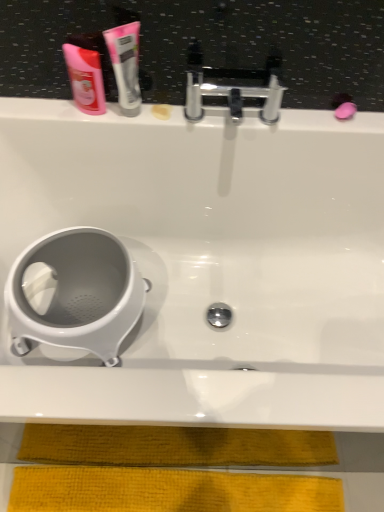
What do you see at coordinates (85, 72) in the screenshot? The width and height of the screenshot is (384, 512). I see `pink glossy mouthwash at upper left` at bounding box center [85, 72].

Measure the distance between white glossy tube at upper center and camera.

white glossy tube at upper center and camera are 33.54 inches apart from each other.

Where is `white plastic toilet at lower left`? Image resolution: width=384 pixels, height=512 pixels. white plastic toilet at lower left is located at coordinates (74, 294).

Is white glossy tube at upper center positioned beyond the bounds of white glossy bathtub at center?

Yes, white glossy tube at upper center is located beyond the bounds of white glossy bathtub at center.

Is white glossy tube at upper center wider or thinner than white glossy bathtub at center?

Clearly, white glossy tube at upper center has less width compared to white glossy bathtub at center.

Based on the photo, is white glossy tube at upper center smaller than white glossy bathtub at center?

Yes, white glossy tube at upper center is smaller than white glossy bathtub at center.

Which object is positioned more to the right, white glossy tube at upper center or white glossy bathtub at center?

white glossy bathtub at center is more to the right.

Is white plastic toilet at lower left further to camera compared to pink glossy mouthwash at upper left?

Yes, white plastic toilet at lower left is further from the viewer.

From a real-world perspective, between white plastic toilet at lower left and pink glossy mouthwash at upper left, who is vertically lower?

white plastic toilet at lower left is physically lower.

You are a GUI agent. You are given a task and a screenshot of the screen. Output one action in this format:
    pyautogui.click(x=<x>, y=<y>)
    Task: Click on the toilet to the left of pink glossy mouthwash at upper left
    The height and width of the screenshot is (512, 384).
    Given the screenshot: What is the action you would take?
    pyautogui.click(x=74, y=294)

Is white plastic toilet at lower left far from pink glossy mouthwash at upper left?

white plastic toilet at lower left is actually quite close to pink glossy mouthwash at upper left.

Image resolution: width=384 pixels, height=512 pixels. I want to click on bathtub located on the right of pink glossy mouthwash at upper left, so click(x=211, y=262).

Who is smaller, pink glossy mouthwash at upper left or white glossy bathtub at center?

With smaller size is pink glossy mouthwash at upper left.

Measure the distance from pink glossy mouthwash at upper left to white glossy bathtub at center.

pink glossy mouthwash at upper left and white glossy bathtub at center are 16.73 inches apart from each other.

From a real-world perspective, is pink glossy mouthwash at upper left above or below white glossy bathtub at center?

pink glossy mouthwash at upper left is above white glossy bathtub at center.

From the picture: Is white glossy tube at upper center at the back of white plastic toilet at lower left?

white plastic toilet at lower left does not have its back to white glossy tube at upper center.

Considering the relative positions of white plastic toilet at lower left and white glossy tube at upper center in the image provided, is white plastic toilet at lower left to the right of white glossy tube at upper center from the viewer's perspective?

Incorrect, white plastic toilet at lower left is not on the right side of white glossy tube at upper center.

Which is in front, point (71, 76) or point (124, 32)?

Point (124, 32)

Is pink glossy mouthwash at upper left outside of white glossy tube at upper center?

Absolutely, pink glossy mouthwash at upper left is external to white glossy tube at upper center.

Is pink glossy mouthwash at upper left taller than white glossy tube at upper center?

No.

Which object is closer to the camera, pink glossy mouthwash at upper left or white glossy tube at upper center?

white glossy tube at upper center is in front.

Considering the points (134, 32) and (99, 38), which point is behind, point (134, 32) or point (99, 38)?

Positioned behind is point (99, 38).

Is white glossy tube at upper center positioned before pink glossy mouthwash at upper left?

Yes, white glossy tube at upper center is closer to the viewer.

In the scene shown: From a real-world perspective, is white glossy tube at upper center physically located above or below pink glossy mouthwash at upper left?

From a real-world perspective, white glossy tube at upper center is physically above pink glossy mouthwash at upper left.

From a real-world perspective, which object rests below the other?

polished chrome faucet at upper center is physically lower.

Looking at this image, is white glossy tube at upper center oriented towards polished chrome faucet at upper center?

No, white glossy tube at upper center is not turned towards polished chrome faucet at upper center.

Does white glossy tube at upper center have a larger size compared to polished chrome faucet at upper center?

Actually, white glossy tube at upper center might be smaller than polished chrome faucet at upper center.

Which point is more forward, (118, 72) or (194, 89)?

The point (118, 72) is closer.

Find the location of a particular element. toothpaste that appears above the white glossy bathtub at center (from the image's perspective) is located at coordinates point(125,65).

The image size is (384, 512). Find the location of `toilet lying behind the pink glossy mouthwash at upper left`. toilet lying behind the pink glossy mouthwash at upper left is located at coordinates (74, 294).

Considering their positions, is pink glossy mouthwash at upper left positioned closer to white plastic toilet at lower left than white glossy tube at upper center?

pink glossy mouthwash at upper left is closer to white plastic toilet at lower left.

When comparing their distances from white glossy tube at upper center, does pink glossy mouthwash at upper left or polished chrome faucet at upper center seem further?

The object further to white glossy tube at upper center is polished chrome faucet at upper center.

Looking at the image, which one is located further to polished chrome faucet at upper center, white glossy tube at upper center or pink glossy mouthwash at upper left?

Among the two, pink glossy mouthwash at upper left is located further to polished chrome faucet at upper center.

From the image, which object appears to be farther from white glossy bathtub at center, pink glossy mouthwash at upper left or white glossy tube at upper center?

pink glossy mouthwash at upper left lies further to white glossy bathtub at center than the other object.

Based on their spatial positions, is pink glossy mouthwash at upper left or white plastic toilet at lower left closer to polished chrome faucet at upper center?

pink glossy mouthwash at upper left is positioned closer to the anchor polished chrome faucet at upper center.

From the image, which object appears to be farther from white glossy bathtub at center, polished chrome faucet at upper center or white plastic toilet at lower left?

Among the two, polished chrome faucet at upper center is located further to white glossy bathtub at center.

From the image, which object appears to be farther from pink glossy mouthwash at upper left, white plastic toilet at lower left or white glossy tube at upper center?

white plastic toilet at lower left.

Considering their positions, is white plastic toilet at lower left positioned closer to white glossy tube at upper center than white glossy bathtub at center?

white glossy bathtub at center is positioned closer to the anchor white glossy tube at upper center.

You are a GUI agent. You are given a task and a screenshot of the screen. Output one action in this format:
    pyautogui.click(x=<x>, y=<y>)
    Task: Click on the bathtub that lies between white glossy tube at upper center and white plastic toilet at lower left from top to bottom
    The height and width of the screenshot is (512, 384).
    Given the screenshot: What is the action you would take?
    pyautogui.click(x=211, y=262)

You are a GUI agent. You are given a task and a screenshot of the screen. Output one action in this format:
    pyautogui.click(x=<x>, y=<y>)
    Task: Click on the bathtub between pink glossy mouthwash at upper left and white plastic toilet at lower left vertically
    
    Given the screenshot: What is the action you would take?
    pyautogui.click(x=211, y=262)

Where is `tap between pink glossy mouthwash at upper left and white plastic toilet at lower left in the vertical direction`? The width and height of the screenshot is (384, 512). tap between pink glossy mouthwash at upper left and white plastic toilet at lower left in the vertical direction is located at coordinates (232, 97).

Locate an element on the screen. The width and height of the screenshot is (384, 512). toothpaste between pink glossy mouthwash at upper left and polished chrome faucet at upper center is located at coordinates pos(125,65).